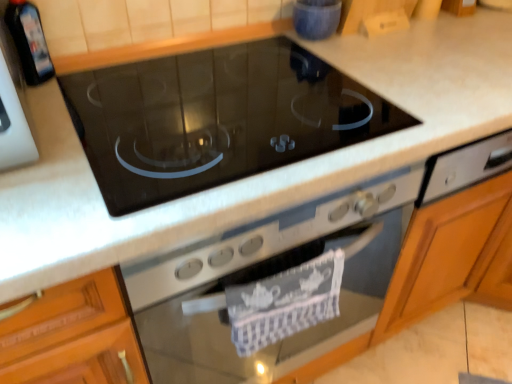
Question: From a real-world perspective, is black glass cooktop at center physically above black glass bottle at upper left, which is the 2th appliance from right to left?

Choices:
 (A) yes
 (B) no

Answer: (B)

Question: Does black glass cooktop at center have a lesser width compared to black glass bottle at upper left, the first appliance from the left?

Choices:
 (A) yes
 (B) no

Answer: (B)

Question: Can you confirm if black glass cooktop at center is bigger than black glass bottle at upper left, the first appliance from the left?

Choices:
 (A) yes
 (B) no

Answer: (A)

Question: Considering the relative sizes of black glass cooktop at center and black glass bottle at upper left, the first appliance viewed from the front, in the image provided, is black glass cooktop at center taller than black glass bottle at upper left, the first appliance viewed from the front,?

Choices:
 (A) yes
 (B) no

Answer: (B)

Question: Is black glass cooktop at center positioned with its back to black glass bottle at upper left, positioned as the 2th appliance in back-to-front order?

Choices:
 (A) no
 (B) yes

Answer: (A)

Question: Which is correct: black glass bottle at upper left, the first appliance from the left, is inside black glass cooktop at center, or outside of it?

Choices:
 (A) inside
 (B) outside

Answer: (B)

Question: Is black glass bottle at upper left, the first appliance from the left, wider or thinner than black glass cooktop at center?

Choices:
 (A) wide
 (B) thin

Answer: (B)

Question: From the image's perspective, relative to black glass cooktop at center, is black glass bottle at upper left, the first appliance from the left, above or below?

Choices:
 (A) below
 (B) above

Answer: (B)

Question: Is point (29, 56) positioned closer to the camera than point (178, 135)?

Choices:
 (A) farther
 (B) closer

Answer: (A)

Question: Considering the positions of black glass cooktop at center and blue glossy bowl at upper center, which ranks as the 2th appliance in front-to-back order, in the image, is black glass cooktop at center taller or shorter than blue glossy bowl at upper center, which ranks as the 2th appliance in front-to-back order,?

Choices:
 (A) tall
 (B) short

Answer: (A)

Question: From a real-world perspective, is black glass cooktop at center physically located above or below blue glossy bowl at upper center, acting as the 2th appliance starting from the left?

Choices:
 (A) above
 (B) below

Answer: (B)

Question: Is point (382, 296) closer or farther from the camera than point (317, 4)?

Choices:
 (A) farther
 (B) closer

Answer: (A)

Question: Is black glass cooktop at center spatially inside blue glossy bowl at upper center, positioned as the first appliance in right-to-left order, or outside of it?

Choices:
 (A) outside
 (B) inside

Answer: (A)

Question: Considering their positions, is blue glossy bowl at upper center, positioned as the first appliance in back-to-front order, located in front of or behind black glass bottle at upper left, the first appliance viewed from the front?

Choices:
 (A) front
 (B) behind

Answer: (B)

Question: From the image's perspective, is blue glossy bowl at upper center, positioned as the first appliance in back-to-front order, located above or below black glass bottle at upper left, the first appliance viewed from the front?

Choices:
 (A) below
 (B) above

Answer: (B)